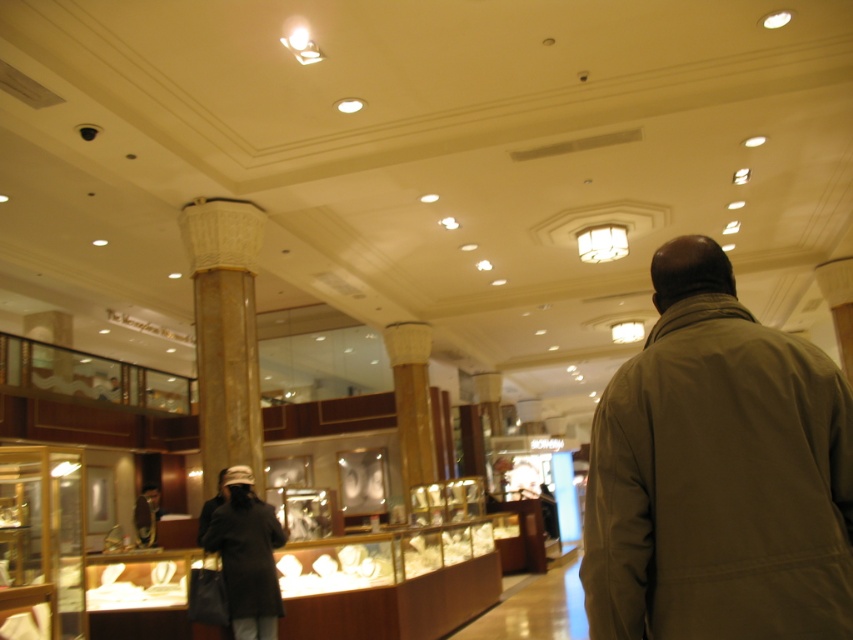
Does khaki fabric jacket at center come in front of matte black jacket at lower left?

Yes, it is in front of matte black jacket at lower left.

Where is `khaki fabric jacket at center`? This screenshot has height=640, width=853. khaki fabric jacket at center is located at coordinates (718, 474).

Between dark brown leather jacket at lower left and matte black jacket at lower left, which one has less height?

With less height is matte black jacket at lower left.

Who is positioned more to the left, dark brown leather jacket at lower left or matte black jacket at lower left?

matte black jacket at lower left is more to the left.

Which is in front, point (247, 580) or point (137, 502)?

Point (247, 580)

The height and width of the screenshot is (640, 853). I want to click on dark brown leather jacket at lower left, so click(x=247, y=556).

What do you see at coordinates (718, 474) in the screenshot? I see `khaki fabric jacket at center` at bounding box center [718, 474].

Image resolution: width=853 pixels, height=640 pixels. What are the coordinates of `khaki fabric jacket at center` in the screenshot? It's located at (718, 474).